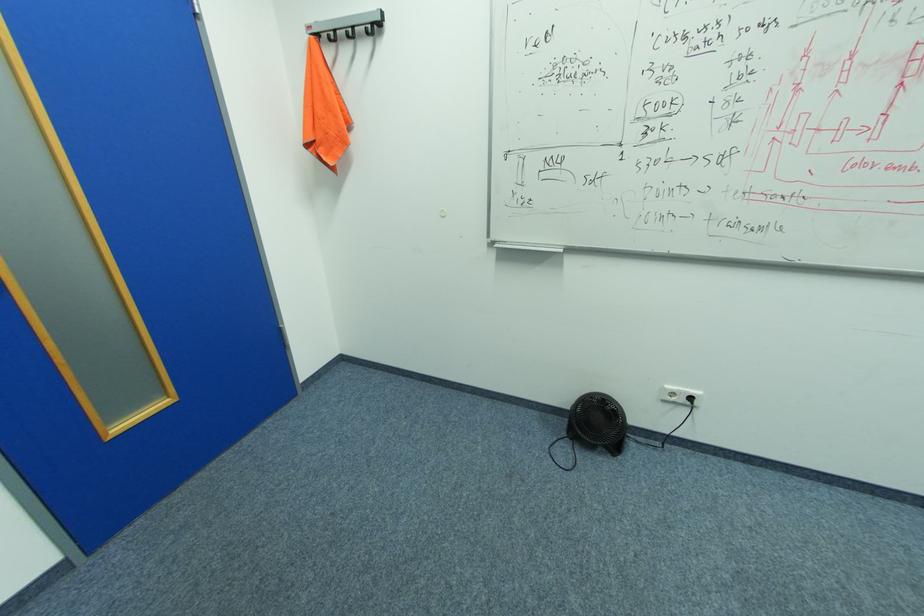
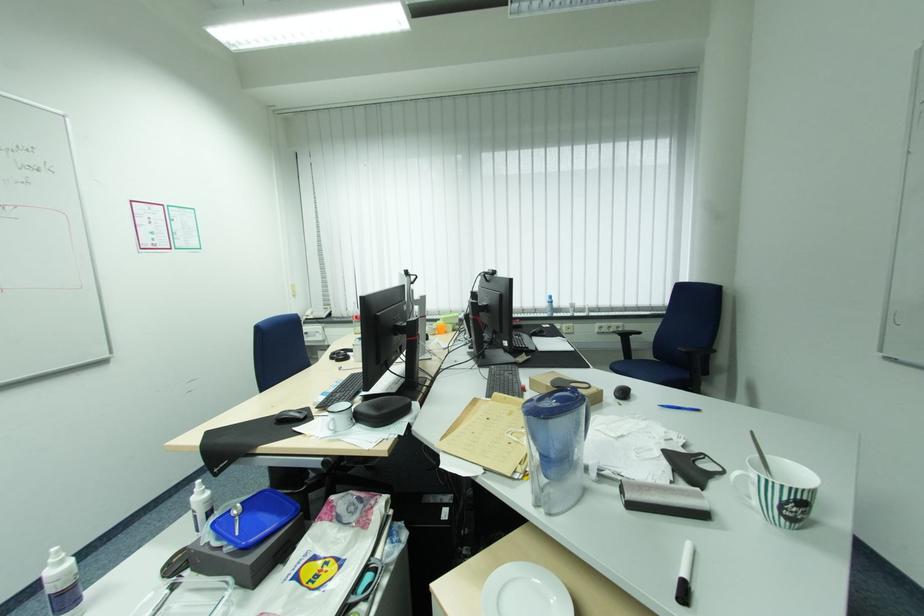
Question: The camera is either moving clockwise (left) or counter-clockwise (right) around the object. The first image is from the beginning of the video and the second image is from the end. Is the camera moving left or right when shooting the video?

Choices:
 (A) Left
 (B) Right

Answer: (A)